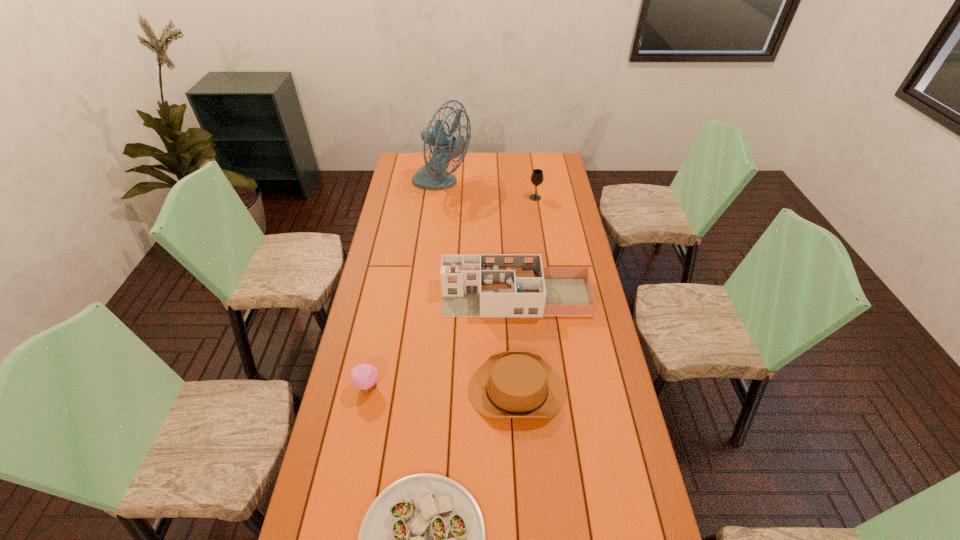
Where is `vacant area that lies between the cowboy hat and the cupcake`? Image resolution: width=960 pixels, height=540 pixels. vacant area that lies between the cowboy hat and the cupcake is located at coordinates (443, 389).

Identify which object is located as the third nearest to the cupcake. Please provide its 2D coordinates. Your answer should be formatted as a tuple, i.e. [(x, y)], where the tuple contains the x and y coordinates of a point satisfying the conditions above.

[(473, 285)]

At what (x,y) coordinates should I click in order to perform the action: click on object that stands as the second closest to the cupcake. Please return your answer as a coordinate pair (x, y). The height and width of the screenshot is (540, 960). Looking at the image, I should click on (511, 384).

At what (x,y) coordinates should I click in order to perform the action: click on vacant area that satisfies the following two spatial constraints: 1. in front of the tallest object to blow air; 2. on the right side of the wineglass. Please return your answer as a coordinate pair (x, y). Image resolution: width=960 pixels, height=540 pixels. Looking at the image, I should click on (440, 198).

Find the location of `free point that satisfies the following two spatial constraints: 1. on the front side of the wineglass; 2. at the entrance of the dollhouse`. free point that satisfies the following two spatial constraints: 1. on the front side of the wineglass; 2. at the entrance of the dollhouse is located at coordinates (x=550, y=297).

Find the location of a particular element. free space in the image that satisfies the following two spatial constraints: 1. on the front side of the wineglass; 2. at the entrance of the dollhouse is located at coordinates (550, 297).